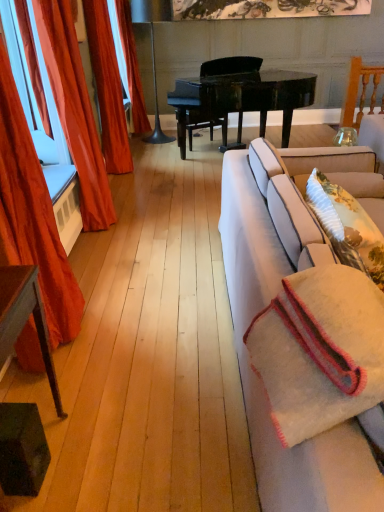
Identify the location of free spot to the right of velvet orange curtain at left, which is the 1th curtain from front to back. (125, 332).